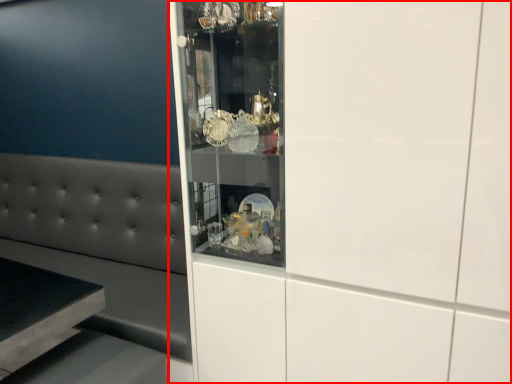
Question: In this image, where is cabinetry (annotated by the red box) located relative to furniture?

Choices:
 (A) right
 (B) left

Answer: (A)